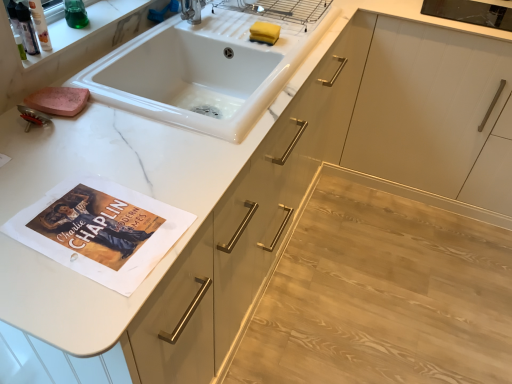
Where is `vacant space situated on the left part of yellow sponge at sink`? The image size is (512, 384). vacant space situated on the left part of yellow sponge at sink is located at coordinates (224, 32).